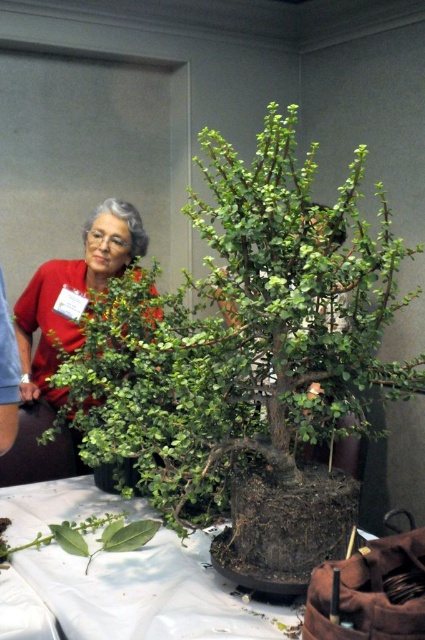
Which is more to the left, green matte bonsai tree at center or matte red blouse at center?

matte red blouse at center is more to the left.

Which is behind, point (354, 291) or point (28, 298)?

The point (28, 298) is more distant.

At what (x,y) coordinates should I click in order to perform the action: click on green matte bonsai tree at center. Please return your answer as a coordinate pair (x, y). Looking at the image, I should click on (249, 356).

Where is `green matte bonsai tree at center`? The image size is (425, 640). green matte bonsai tree at center is located at coordinates (249, 356).

From the picture: Who is taller, green matte bonsai tree at center or white fabric table at center?

green matte bonsai tree at center is taller.

Who is more forward, (x=385, y=284) or (x=42, y=515)?

Positioned in front is point (x=42, y=515).

Where is `green matte bonsai tree at center`? This screenshot has height=640, width=425. green matte bonsai tree at center is located at coordinates (x=249, y=356).

Does white fabric table at center have a lesser height compared to matte red blouse at center?

Yes.

Between white fabric table at center and matte red blouse at center, which one has more height?

With more height is matte red blouse at center.

This screenshot has height=640, width=425. What do you see at coordinates (150, 593) in the screenshot?
I see `white fabric table at center` at bounding box center [150, 593].

At what (x,y) coordinates should I click in order to perform the action: click on white fabric table at center. Please return your answer as a coordinate pair (x, y). The image size is (425, 640). Looking at the image, I should click on (150, 593).